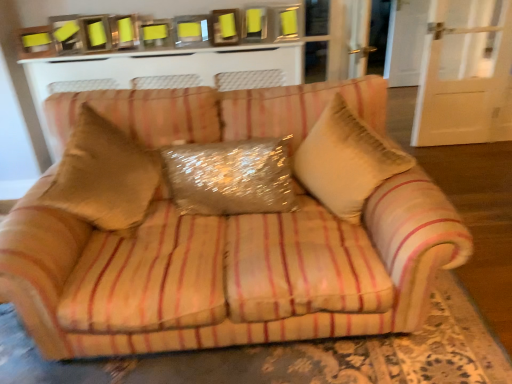
Question: Considering the relative positions of beige textured pillow at center and white textured cabinet at upper center in the image provided, is beige textured pillow at center to the left or to the right of white textured cabinet at upper center?

Choices:
 (A) left
 (B) right

Answer: (B)

Question: Is point (346, 182) positioned closer to the camera than point (174, 61)?

Choices:
 (A) closer
 (B) farther

Answer: (A)

Question: Considering the real-world distances, which object is farthest from the white textured cabinet at upper center?

Choices:
 (A) sparkly metallic pillow at center
 (B) beige striped fabric couch at center
 (C) beige textured pillow at center

Answer: (B)

Question: Estimate the real-world distances between objects in this image. Which object is farther from the sparkly metallic pillow at center?

Choices:
 (A) white textured cabinet at upper center
 (B) beige striped fabric couch at center
 (C) beige textured pillow at center

Answer: (A)